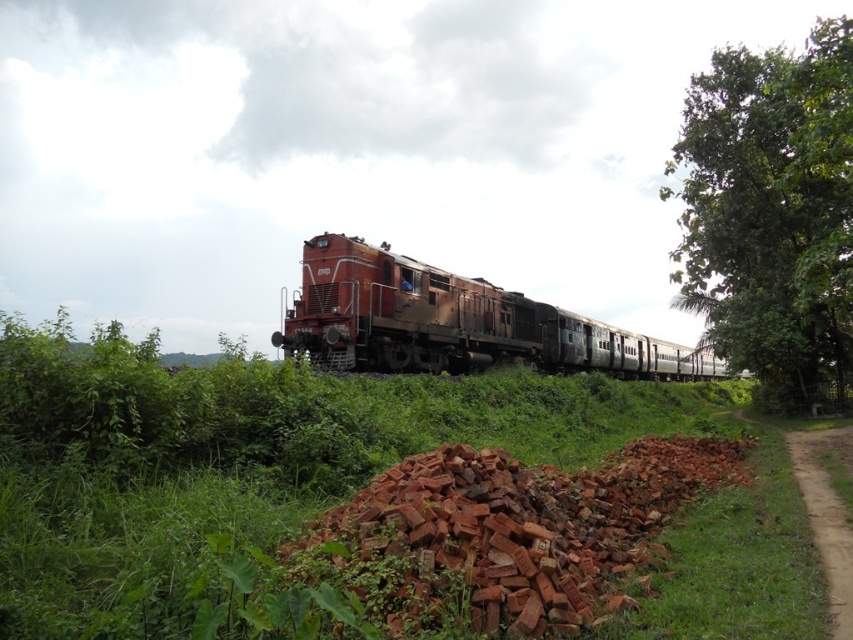
You are a railway inspector checking the tracks. You see the rusty metal train at center and the brown dirt track at lower right. Which object is closer to the right edge of the image?

The rusty metal train at center is positioned on the right side of brown dirt track at lower right, so the rusty metal train at center is closer to the right edge of the image.

You are a railway inspector checking the track conditions. You notice the brick rubble at lower center and the brown dirt track at lower right. Which object is positioned to the left side from your viewpoint?

The brick rubble at lower center is to the left of brown dirt track at lower right, so the brick rubble at lower center is positioned to the left side from your viewpoint.

You are standing at the point with coordinates (x=453, y=323) in the image. What object are you currently standing on?

The point with coordinates (x=453, y=323) is on the rusty metal train at center.